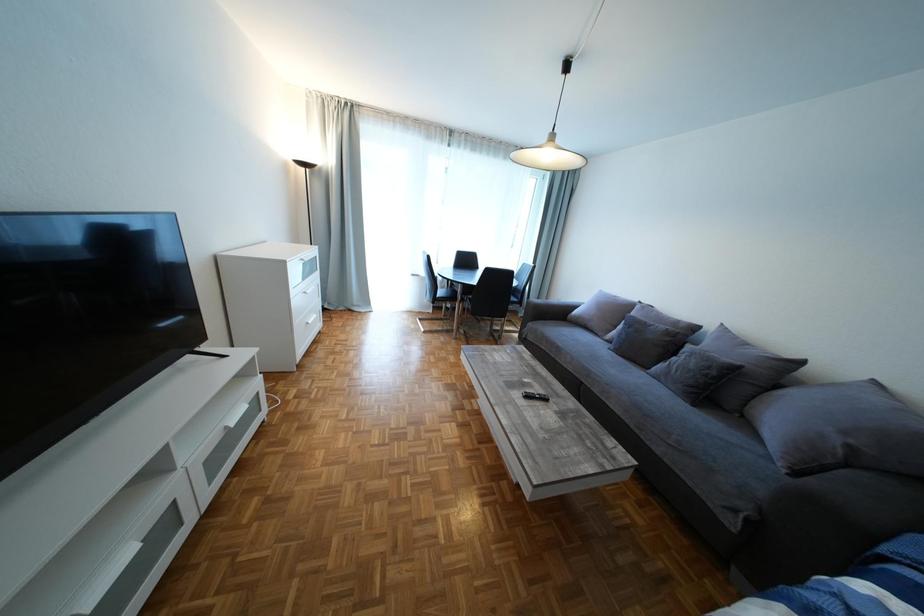
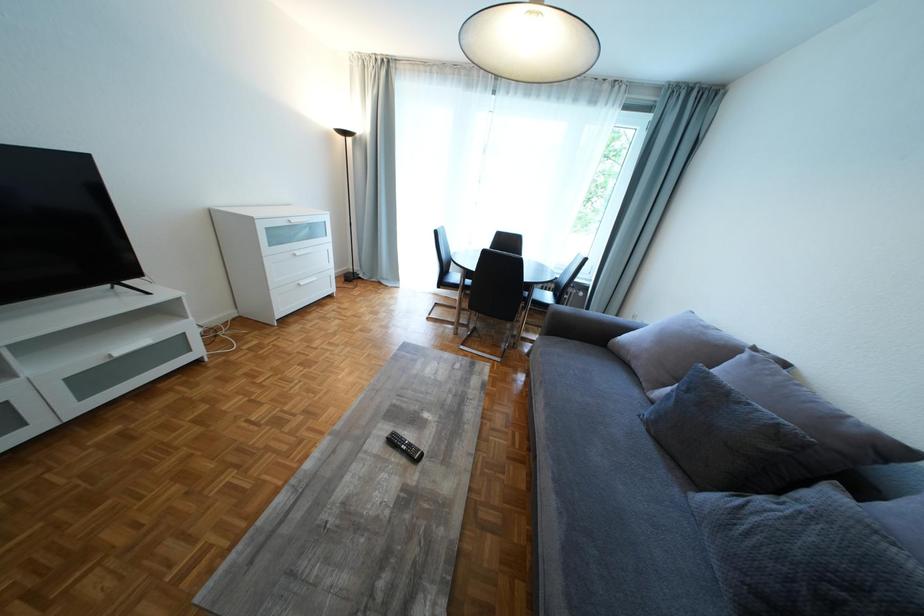
What movement of the cameraman would produce the second image?

The cameraman moved toward right, forward.